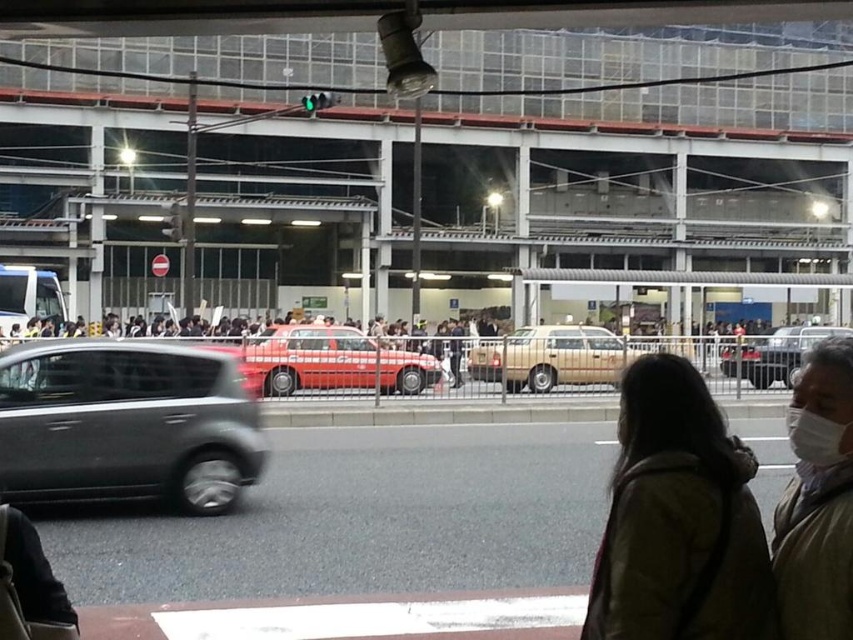
You are standing at the pedestrian crossing in the image. There is a point marked at coordinates (817, 500). What object does this point correspond to?

The point corresponds to the light brown textured coat at lower right.

You are a delivery driver who needs to park your car in a space that can only accommodate vehicles smaller than the person standing nearby. You see the satin black hatchback at left and the dark brown leather jacket at lower right in the scene. Which vehicle should you choose to park?

The dark brown leather jacket at lower right is smaller than the satin black hatchback at left, so you should park the dark brown leather jacket at lower right.